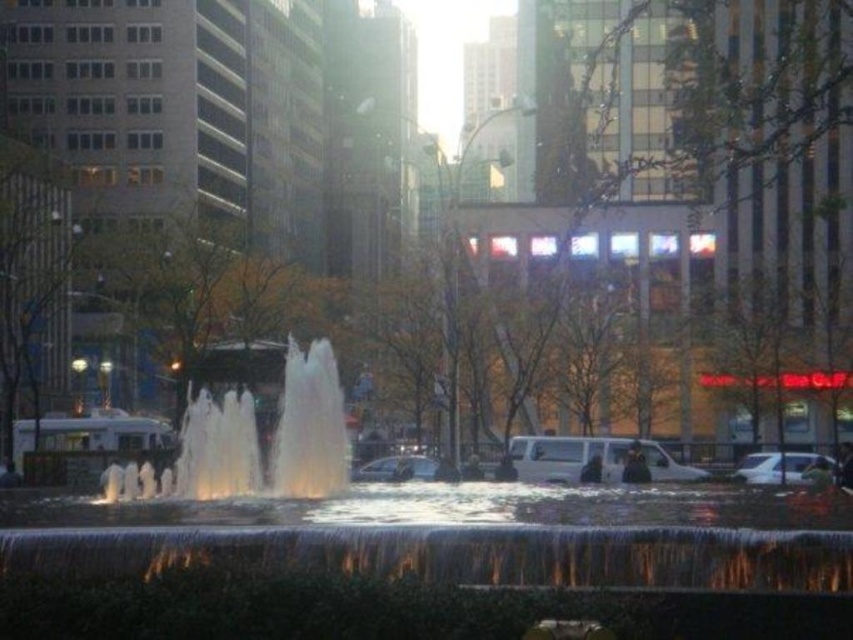
Does clear water at center appear over white glossy car at lower right?

Yes.

Between clear water at center and white glossy car at lower right, which one has less height?

white glossy car at lower right

Between point (300, 420) and point (781, 452), which one is positioned behind?

Positioned behind is point (781, 452).

At what (x,y) coordinates should I click in order to perform the action: click on clear water at center. Please return your answer as a coordinate pair (x, y). The width and height of the screenshot is (853, 640). Looking at the image, I should click on (254, 442).

Does point (699, 472) come closer to viewer compared to point (421, 477)?

No, it is not.

Is white matte van at center positioned before shiny silver car at center?

No, white matte van at center is further to the viewer.

Is point (526, 460) closer to camera compared to point (419, 470)?

That is False.

Where is `white matte van at center`? white matte van at center is located at coordinates (566, 456).

Between white matte van at center and white glossy car at lower right, which one has less height?

white matte van at center

Can you confirm if white matte van at center is shorter than white glossy car at lower right?

Yes, white matte van at center is shorter than white glossy car at lower right.

Is point (573, 456) closer to viewer compared to point (764, 464)?

Yes, point (573, 456) is in front of point (764, 464).

Where is `white matte van at center`? white matte van at center is located at coordinates (566, 456).